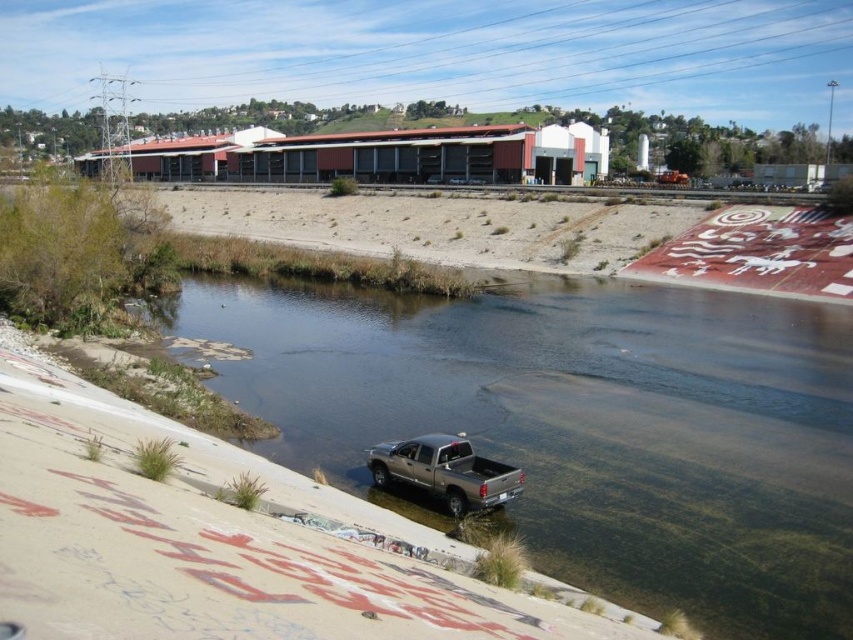
Is point (231, 289) closer to viewer compared to point (474, 490)?

No, it is not.

Between clear water at center and silver metallic truck at lower center, which one appears on the right side from the viewer's perspective?

clear water at center

I want to click on clear water at center, so click(x=579, y=426).